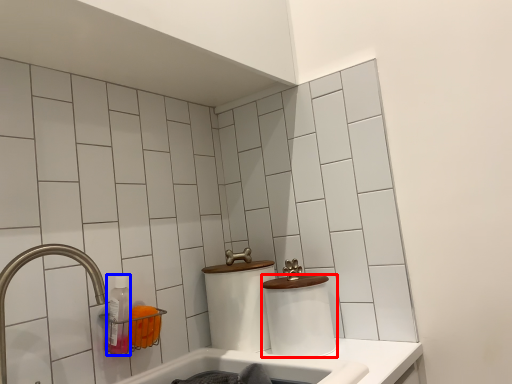
Question: Which of the following is the closest to the observer, toilet paper (highlighted by a red box) or bottle (highlighted by a blue box)?

Choices:
 (A) toilet paper
 (B) bottle

Answer: (B)